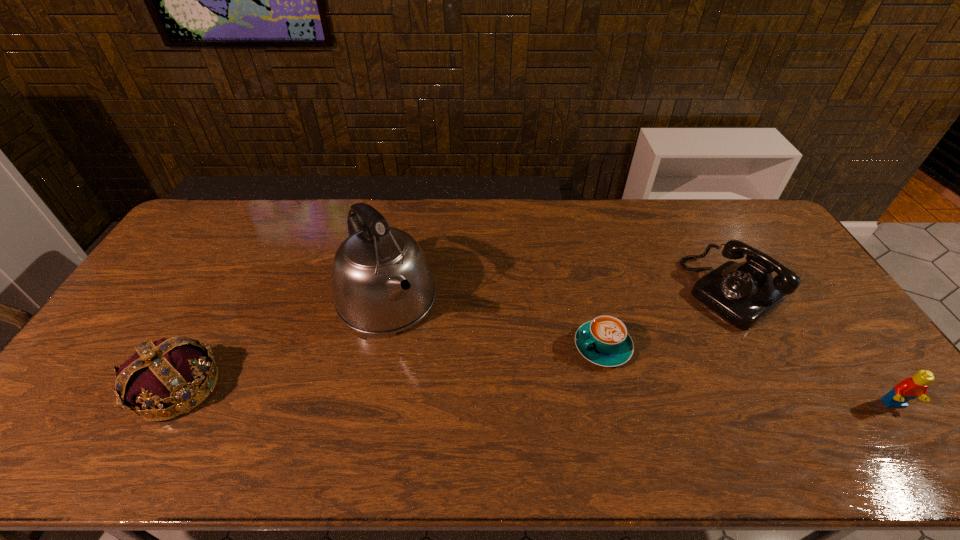
Where is `free spot on the desktop that is between the crown and the Lego and is positioned with the handle on the right side of the shortest object`? Image resolution: width=960 pixels, height=540 pixels. free spot on the desktop that is between the crown and the Lego and is positioned with the handle on the right side of the shortest object is located at coordinates (513, 396).

In order to click on free spot on the desktop that is between the crown and the Lego and is positioned on the dial of the telephone in this screenshot , I will do `click(578, 397)`.

Locate an element on the screen. vacant space on the desktop that is between the crown and the rightmost object and is positioned on the spout of the tallest object is located at coordinates (447, 394).